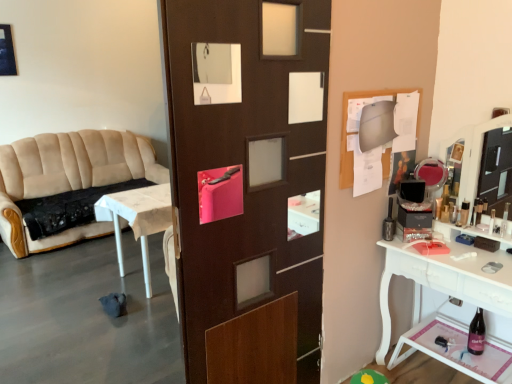
Question: Should I look upward or downward to see beige fabric couch at left?

Choices:
 (A) down
 (B) up

Answer: (B)

Question: Is beige fabric couch at left in contact with metallic silver toiletry at right, which is the 1th toiletry from left to right?

Choices:
 (A) yes
 (B) no

Answer: (B)

Question: Considering the relative sizes of beige fabric couch at left and metallic silver toiletry at right, the second toiletry when ordered from front to back, in the image provided, is beige fabric couch at left shorter than metallic silver toiletry at right, the second toiletry when ordered from front to back,?

Choices:
 (A) no
 (B) yes

Answer: (A)

Question: From a real-world perspective, is beige fabric couch at left under metallic silver toiletry at right, the second toiletry when ordered from front to back?

Choices:
 (A) yes
 (B) no

Answer: (A)

Question: Does beige fabric couch at left lie in front of metallic silver toiletry at right, the second toiletry when ordered from front to back?

Choices:
 (A) no
 (B) yes

Answer: (A)

Question: Is beige fabric couch at left further to the viewer compared to metallic silver toiletry at right, arranged as the first toiletry when viewed from the back?

Choices:
 (A) no
 (B) yes

Answer: (B)

Question: Does beige fabric couch at left have a greater height compared to metallic silver toiletry at right, arranged as the first toiletry when viewed from the back?

Choices:
 (A) no
 (B) yes

Answer: (B)

Question: Is clear plastic bottle at right, which ranks as the first toiletry in right-to-left order, aimed at beige fabric couch at left?

Choices:
 (A) yes
 (B) no

Answer: (B)

Question: Can you confirm if clear plastic bottle at right, which is the second toiletry in left-to-right order, is shorter than beige fabric couch at left?

Choices:
 (A) yes
 (B) no

Answer: (A)

Question: From the image's perspective, would you say clear plastic bottle at right, positioned as the second toiletry in back-to-front order, is positioned over beige fabric couch at left?

Choices:
 (A) no
 (B) yes

Answer: (A)

Question: From a real-world perspective, is clear plastic bottle at right, placed as the first toiletry when sorted from front to back, physically below beige fabric couch at left?

Choices:
 (A) yes
 (B) no

Answer: (B)

Question: Is clear plastic bottle at right, which is the second toiletry in left-to-right order, surrounding beige fabric couch at left?

Choices:
 (A) no
 (B) yes

Answer: (A)

Question: Is clear plastic bottle at right, positioned as the second toiletry in back-to-front order, far away from beige fabric couch at left?

Choices:
 (A) yes
 (B) no

Answer: (A)

Question: Is beige fabric couch at left with clear plastic bottle at right, which is the second toiletry in left-to-right order?

Choices:
 (A) no
 (B) yes

Answer: (A)